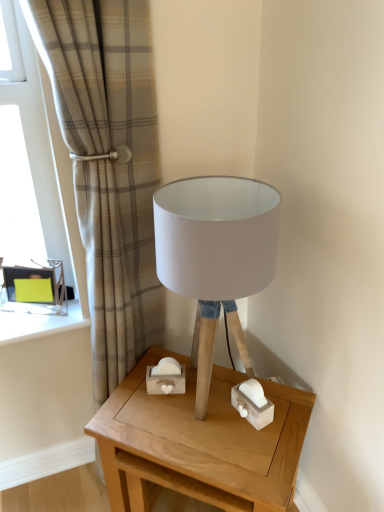
Identify the location of free spot above green cardboard box at left (from a real-world perspective). Image resolution: width=384 pixels, height=512 pixels. (41, 308).